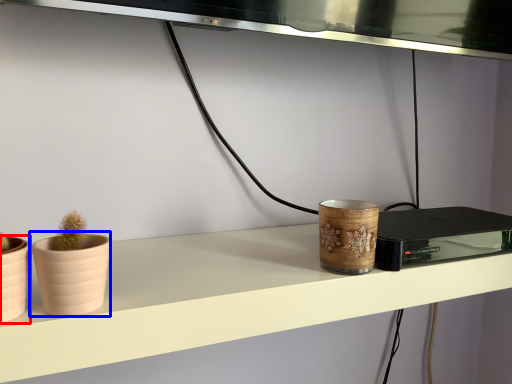
Question: Which object is closer to the camera taking this photo, flowerpot (highlighted by a red box) or flowerpot (highlighted by a blue box)?

Choices:
 (A) flowerpot
 (B) flowerpot

Answer: (A)